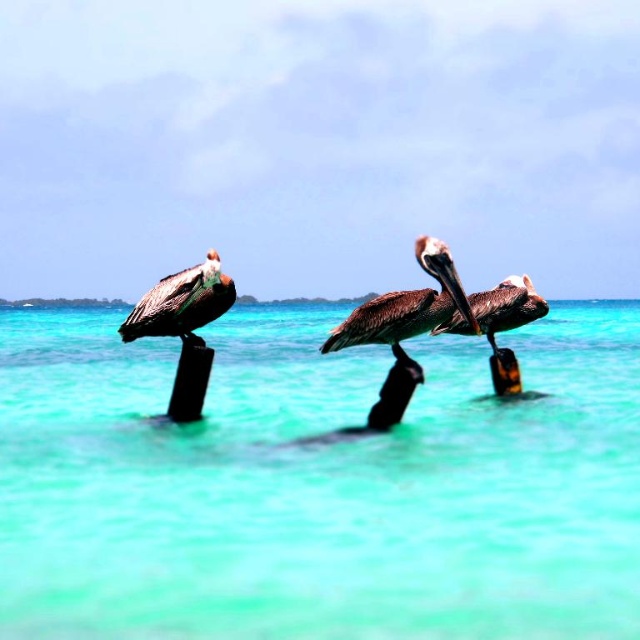
You are a birdwatcher observing the coastal scene. You notice the turquoise water at center. Can you determine its exact location in the image using coordinates?

The turquoise water at center is located at coordinates point (317,483).

You are standing on the wooden posts and looking down at the turquoise water at center and the brown feathered pelican at left. Which object is closer to your feet?

The turquoise water at center is located below the brown feathered pelican at left, so the brown feathered pelican at left is closer to your feet.